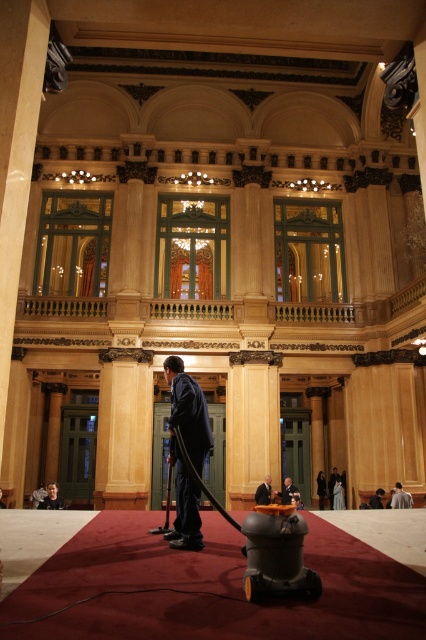
Question: Does dark gray fabric jacket at lower right appear on the right side of dark blue suit at center?

Choices:
 (A) no
 (B) yes

Answer: (B)

Question: Observing the image, what is the correct spatial positioning of dark gray fabric jacket at lower right in reference to dark blue fabric suit at center?

Choices:
 (A) above
 (B) below

Answer: (A)

Question: Among these objects, which one is nearest to the camera?

Choices:
 (A) dark gray fabric jacket at lower right
 (B) dark blue fabric suit at center
 (C) dark blue fabric man at center
 (D) matte black vacuum cleaner at center

Answer: (D)

Question: Among these points, which one is nearest to the camera?

Choices:
 (A) (199, 440)
 (B) (406, 508)

Answer: (A)

Question: Does dark blue fabric man at center have a lesser width compared to dark gray suit at center?

Choices:
 (A) no
 (B) yes

Answer: (A)

Question: Among these points, which one is farthest from the camera?

Choices:
 (A) pos(411,497)
 (B) pos(296,499)

Answer: (B)